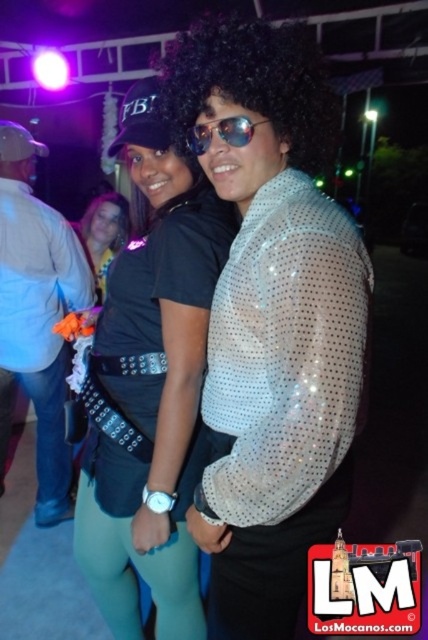
Is point (68, 451) farther from viewer compared to point (83, 234)?

No, (68, 451) is closer to viewer.

Between brushed metal belt at left and black curly hair at center, which one is positioned lower?

brushed metal belt at left is lower down.

Is point (14, 304) less distant than point (91, 208)?

Yes, it is in front of point (91, 208).

Locate an element on the screen. brushed metal belt at left is located at coordinates (36, 316).

Is point (300, 157) positioned in front of point (240, 145)?

No, (300, 157) is behind (240, 145).

Does black curly wig at center have a greater width compared to sunglasses at center?

Yes, black curly wig at center is wider than sunglasses at center.

Where is `black curly wig at center`? This screenshot has height=640, width=428. black curly wig at center is located at coordinates (252, 84).

How much distance is there between shiny sequined shirt at center and teal spandex leggings at lower center?

They are 18.93 inches apart.

Does shiny sequined shirt at center have a smaller size compared to teal spandex leggings at lower center?

No.

Measure the distance between point (323, 355) and camera.

The distance of point (323, 355) from camera is 34.04 inches.

Identify the location of shiny sequined shirt at center. This screenshot has height=640, width=428. (272, 321).